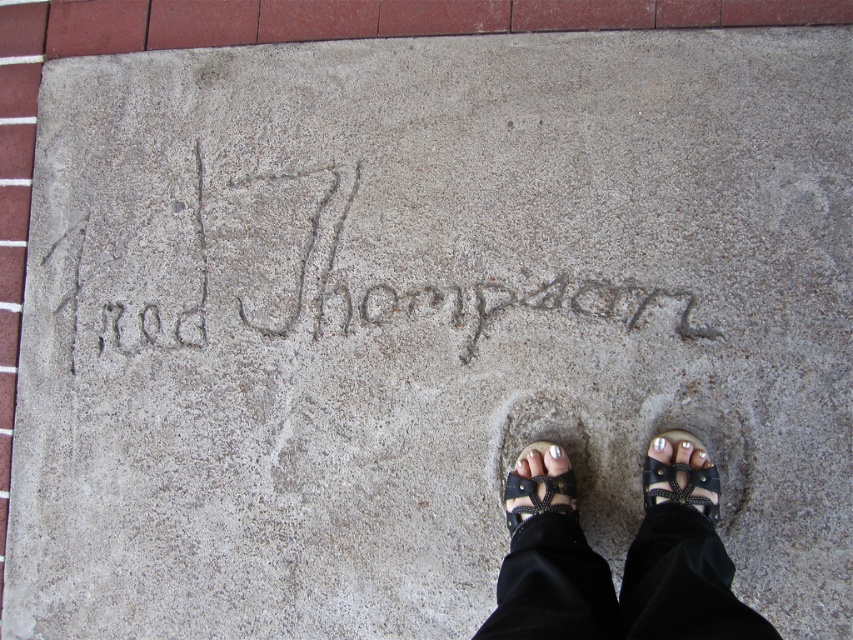
How much distance is there between black leather sandals at center and black leather sandal at center?

black leather sandals at center is 6.37 inches from black leather sandal at center.

You are a GUI agent. You are given a task and a screenshot of the screen. Output one action in this format:
    pyautogui.click(x=<x>, y=<y>)
    Task: Click on the black leather sandals at center
    The height and width of the screenshot is (640, 853).
    Given the screenshot: What is the action you would take?
    pyautogui.click(x=625, y=557)

Identify the location of black leather sandals at center. Image resolution: width=853 pixels, height=640 pixels. (625, 557).

What do you see at coordinates (680, 474) in the screenshot?
I see `black leather sandal at lower right` at bounding box center [680, 474].

Does point (653, 477) lie in front of point (520, 522)?

Yes.

This screenshot has height=640, width=853. In order to click on black leather sandal at lower right in this screenshot , I will do `click(680, 474)`.

Where is `black leather sandal at lower right`? Image resolution: width=853 pixels, height=640 pixels. black leather sandal at lower right is located at coordinates (680, 474).

Does black leather sandals at center appear under gray concrete writing at center?

Indeed, black leather sandals at center is positioned under gray concrete writing at center.

Which is behind, point (621, 589) or point (670, 316)?

Positioned behind is point (670, 316).

Image resolution: width=853 pixels, height=640 pixels. Describe the element at coordinates (625, 557) in the screenshot. I see `black leather sandals at center` at that location.

I want to click on black leather sandals at center, so click(x=625, y=557).